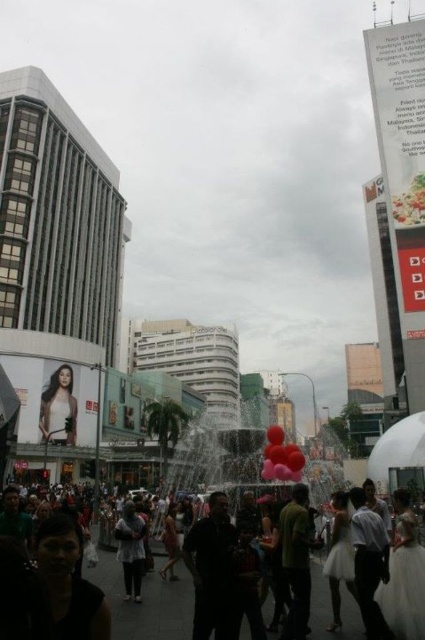
Between light gray shirt at lower right and rubber balloons at center, which one is positioned higher?

light gray shirt at lower right is higher up.

Does light gray shirt at lower right have a lesser width compared to rubber balloons at center?

Yes.

The height and width of the screenshot is (640, 425). Find the location of `light gray shirt at lower right`. light gray shirt at lower right is located at coordinates (368, 563).

Who is lower down, matte black crowd at center or light gray shirt at lower right?

Positioned lower is matte black crowd at center.

Where is `matte black crowd at center`? The image size is (425, 640). matte black crowd at center is located at coordinates (144, 602).

You are a GUI agent. You are given a task and a screenshot of the screen. Output one action in this format:
    pyautogui.click(x=<x>, y=<y>)
    Task: Click on the matte black crowd at center
    The width and height of the screenshot is (425, 640).
    Given the screenshot: What is the action you would take?
    pyautogui.click(x=144, y=602)

What are the coordinates of `matte black crowd at center` in the screenshot? It's located at pyautogui.click(x=144, y=602).

Can you confirm if matte black crowd at center is thinner than matte white dress at lower left?

In fact, matte black crowd at center might be wider than matte white dress at lower left.

Measure the distance between matte black crowd at center and camera.

matte black crowd at center and camera are 28.25 meters apart from each other.

Locate an element on the screen. This screenshot has height=640, width=425. matte black crowd at center is located at coordinates (144, 602).